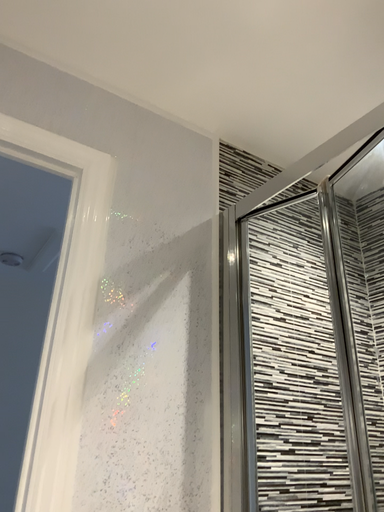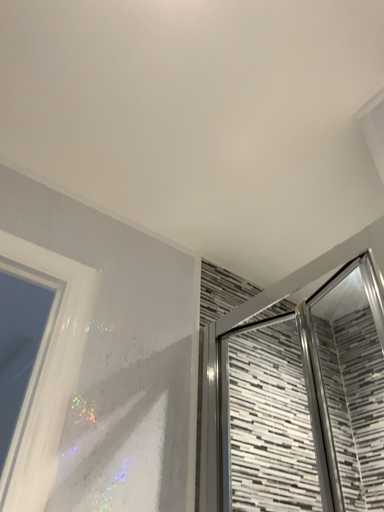
Question: Which way did the camera rotate in the video?

Choices:
 (A) rotated upward
 (B) rotated downward

Answer: (A)